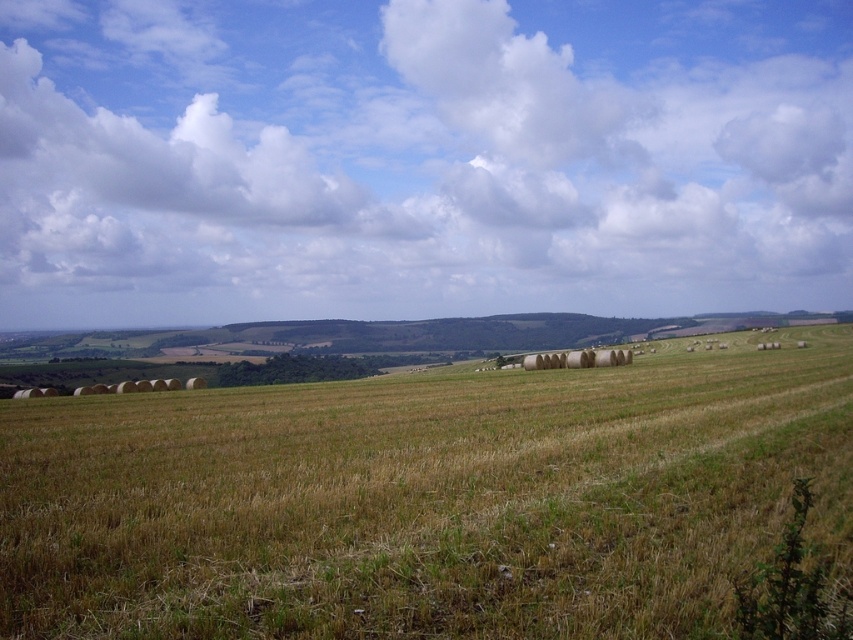
Based on the photo, you are standing in the middle of the field and looking up at the sky. Which object, the white fluffy cloud at upper center or the dry grass at center, is higher from your viewpoint?

The white fluffy cloud at upper center is much taller than the dry grass at center from your viewpoint.

You are a photographer planning to capture the entire field in one shot. You notice the white fluffy cloud at upper center and the dry grass at center. Which object would block more of the camera view if placed directly in front of the lens?

The white fluffy cloud at upper center might be wider than dry grass at center, so it would block more of the camera view if placed directly in front of the lens.

You are standing in the field looking towards the hills. Which object, the white fluffy cloud at upper center or the dry grass at center, is closer to you?

The dry grass at center is behind the white fluffy cloud at upper center, so the white fluffy cloud at upper center is closer to you.